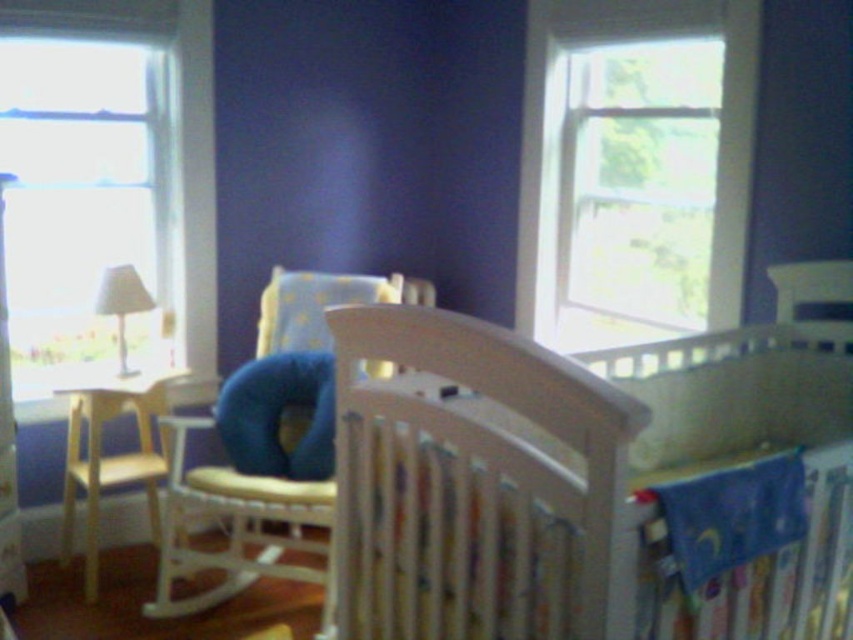
You are a parent trying to reach the white wood rocking chair at upper right from the light wood changing table at left. Which object will you encounter first as you move towards the rocking chair?

You will first encounter the light wood changing table at left because it is closer to you than the white wood rocking chair at upper right, which is further away.

Looking at this image, you are designing a nursery and want to place a 1.2 meter wide crib between the light wood changing table at left and the white wood rocking chair at upper right. Given their widths, will the crib fit between them?

The light wood changing table at left is wider than the white wood rocking chair at upper right. Since the crib is 1.2 meters wide, you need to ensure the distance between the two objects is at least 1.2 meters. However, the exact spacing isn

You are standing in the room depicted in the scene. If you want to look through the transparent glass window at upper right, where should you direct your gaze?

You should direct your gaze to the point at coordinates 0.264 on the x axis and 0.746 on the y axis, which is the location of the transparent glass window at upper right.